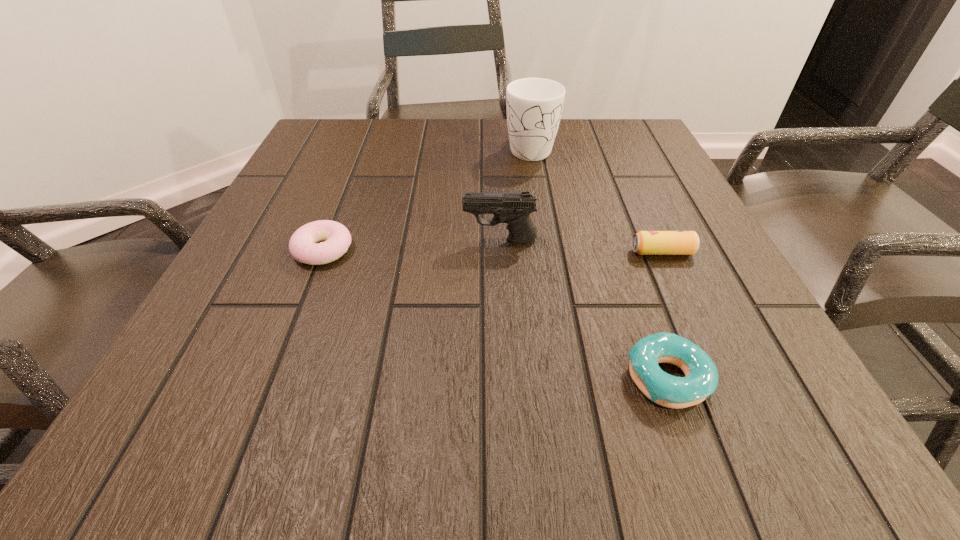
The height and width of the screenshot is (540, 960). In order to click on vacant space that's between the nearest object and the mug in this screenshot , I will do `click(599, 263)`.

This screenshot has width=960, height=540. Identify the location of empty space between the beer can and the pistol. (581, 246).

I want to click on vacant space that's between the nearer doughnut and the beer can, so click(x=665, y=315).

Locate an element on the screen. free space that is in between the beer can and the mug is located at coordinates click(596, 200).

Locate an element on the screen. The width and height of the screenshot is (960, 540). empty space that is in between the right doughnut and the leftmost object is located at coordinates (495, 314).

You are a GUI agent. You are given a task and a screenshot of the screen. Output one action in this format:
    pyautogui.click(x=<x>, y=<y>)
    Task: Click on the empty location between the beer can and the fourth shortest object
    The image size is (960, 540).
    Given the screenshot: What is the action you would take?
    pyautogui.click(x=581, y=246)

The image size is (960, 540). I want to click on object that ranks as the fourth closest to the leftmost object, so click(x=644, y=242).

Identify which object is the third closest to the right doughnut. Please provide its 2D coordinates. Your answer should be formatted as a tuple, i.e. [(x, y)], where the tuple contains the x and y coordinates of a point satisfying the conditions above.

[(337, 239)]

Where is `vacant area in the image that satisfies the following two spatial constraints: 1. on the back side of the nearer doughnut; 2. at the barrel of the pistol`? The image size is (960, 540). vacant area in the image that satisfies the following two spatial constraints: 1. on the back side of the nearer doughnut; 2. at the barrel of the pistol is located at coordinates pyautogui.click(x=618, y=240).

You are a GUI agent. You are given a task and a screenshot of the screen. Output one action in this format:
    pyautogui.click(x=<x>, y=<y>)
    Task: Click on the vacant area in the image that satisfies the following two spatial constraints: 1. on the front side of the nearest object; 2. on the right side of the leftmost object
    This screenshot has width=960, height=540.
    Given the screenshot: What is the action you would take?
    pyautogui.click(x=273, y=378)